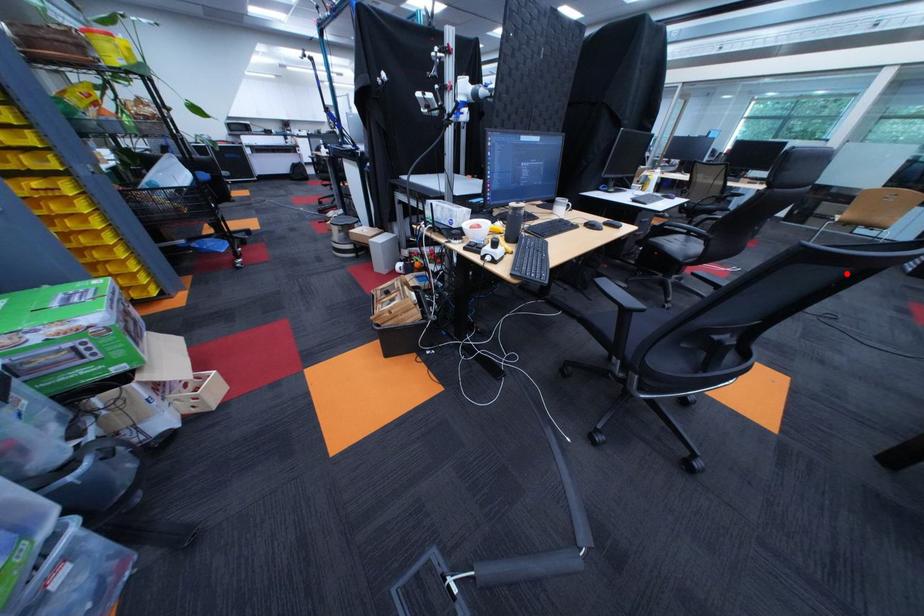
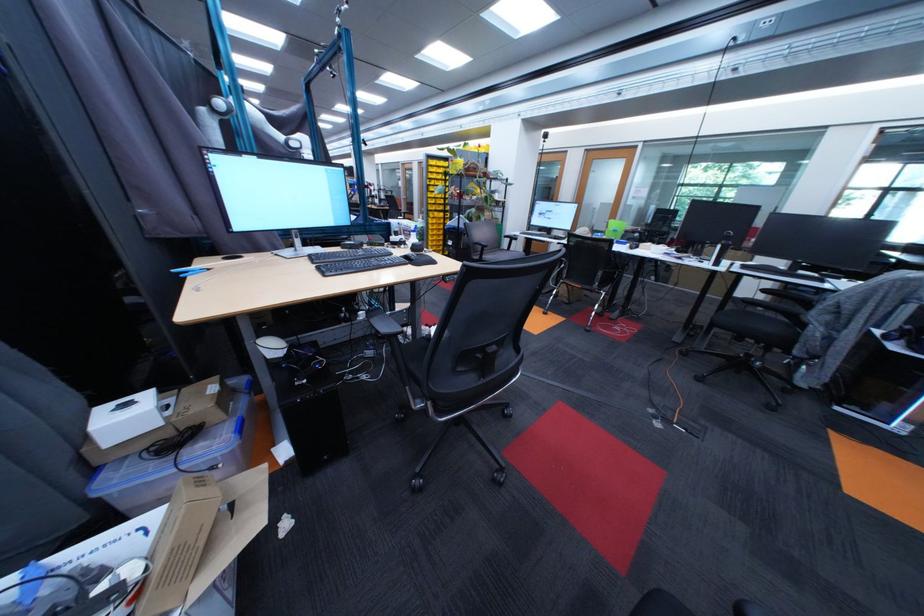
Question: I am providing you with two images of the same scene from different viewpoints. A red point is marked on the first image. Can you still see the location of the red point in image 2?

Choices:
 (A) Yes
 (B) No

Answer: (B)